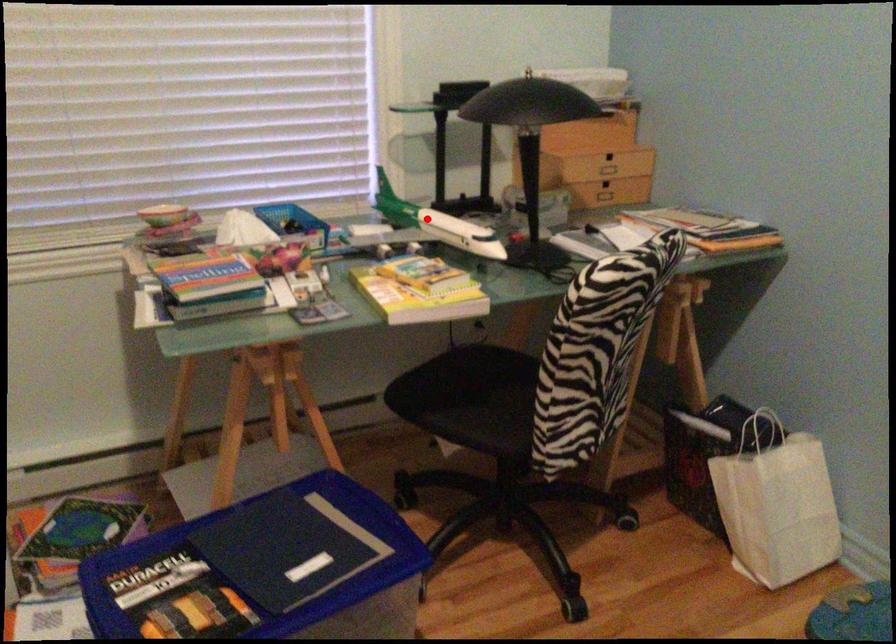
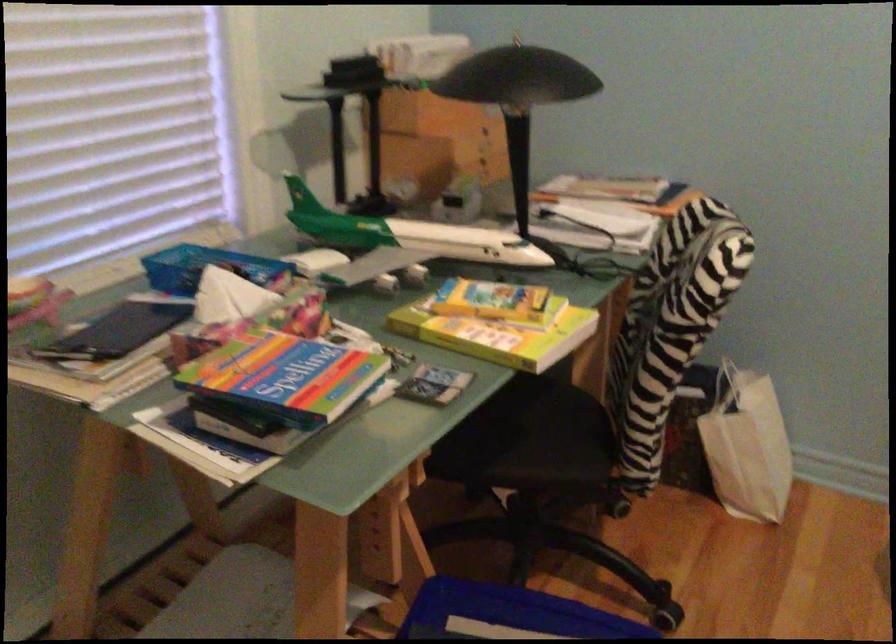
Question: I am providing you with two images of the same scene from different viewpoints. Image1 has a red point marked. In image2, the corresponding 3D location appears at what relative position? Reply with the corresponding letter.

Choices:
 (A) Closer
 (B) Farther

Answer: (A)